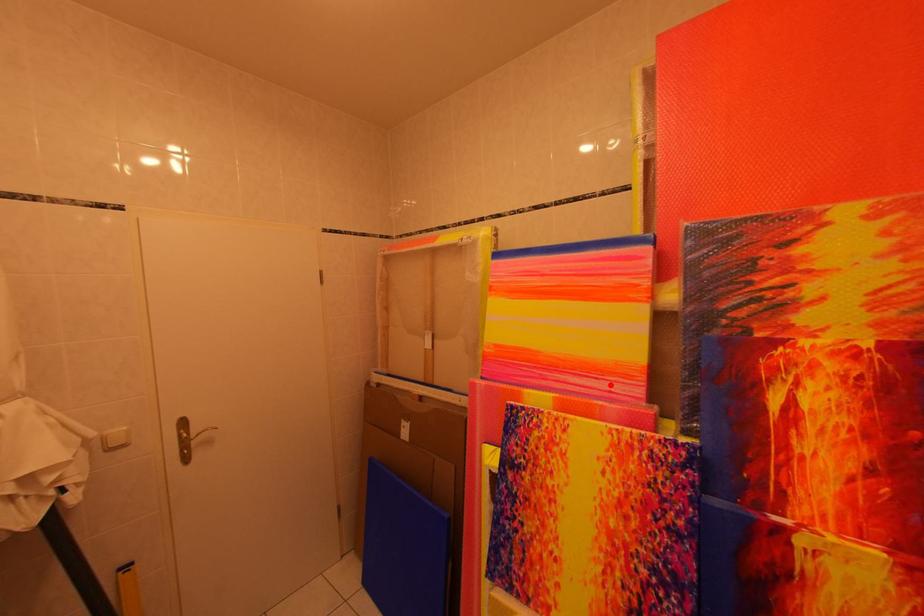
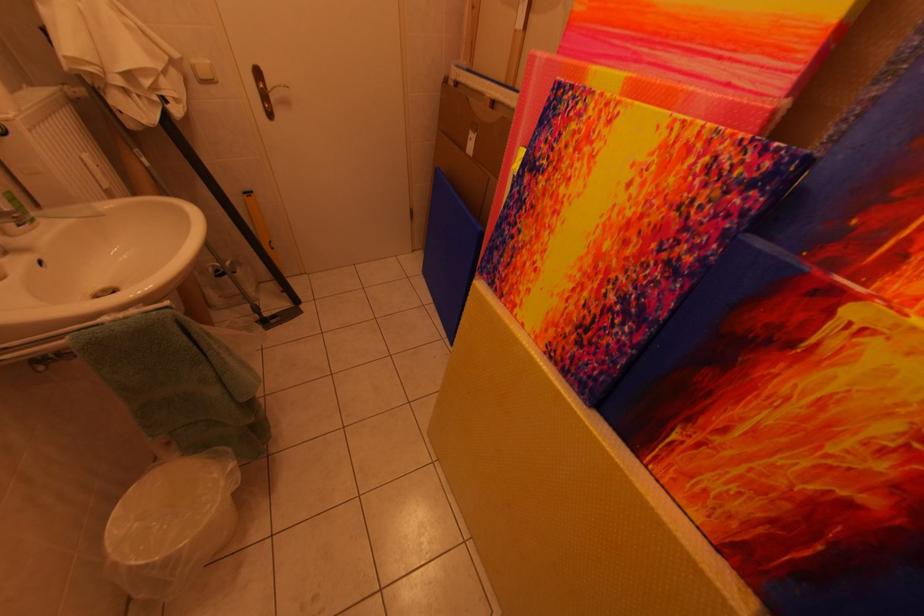
Question: I am providing you with two images of the same scene from different viewpoints. A red point is marked on the first image. Is the red point's position out of view in image 2?

Choices:
 (A) Yes
 (B) No

Answer: (B)